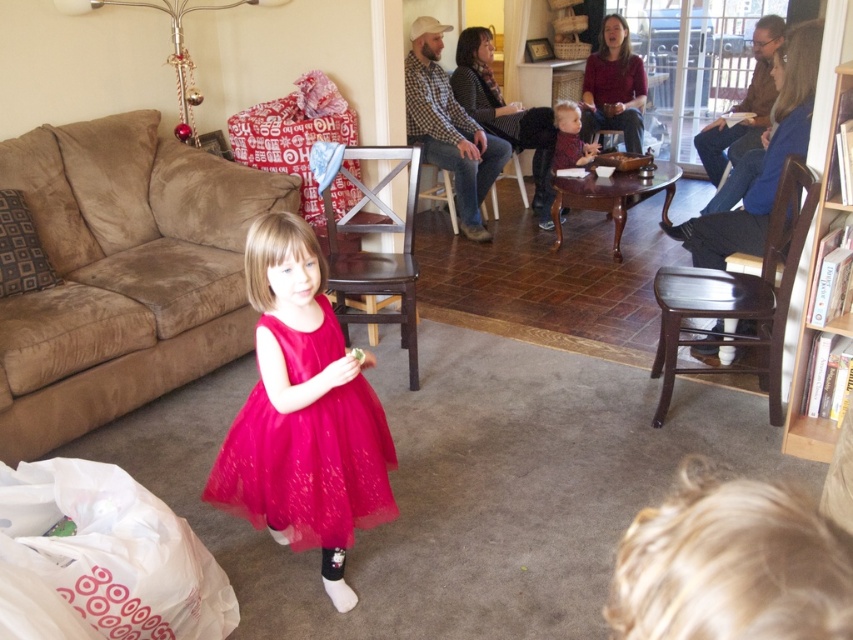
Question: Is suede couch at lower left positioned before matte red sweater at center?

Choices:
 (A) yes
 (B) no

Answer: (A)

Question: Which object appears farthest from the camera in this image?

Choices:
 (A) suede couch at lower left
 (B) fuchsia tulle dress at center
 (C) matte red sweater at center

Answer: (C)

Question: Is suede couch at lower left bigger than matte red sweater at center?

Choices:
 (A) yes
 (B) no

Answer: (A)

Question: Which object is positioned farthest from the fuchsia tulle dress at center?

Choices:
 (A) matte red sweater at center
 (B) suede couch at lower left

Answer: (A)

Question: Which of the following is the farthest from the observer?

Choices:
 (A) suede couch at lower left
 (B) fuchsia tulle dress at center

Answer: (A)

Question: Is suede couch at lower left further to camera compared to matte red sweater at center?

Choices:
 (A) yes
 (B) no

Answer: (B)